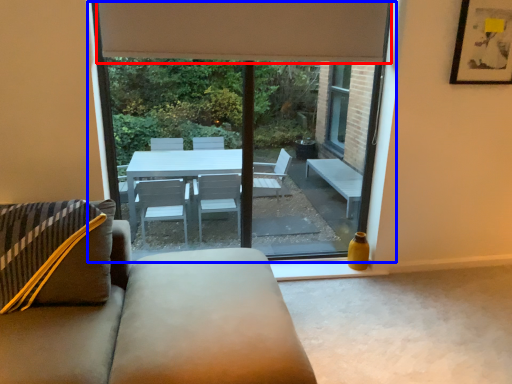
Question: Which object is further to the camera taking this photo, curtain (highlighted by a red box) or window (highlighted by a blue box)?

Choices:
 (A) curtain
 (B) window

Answer: (B)